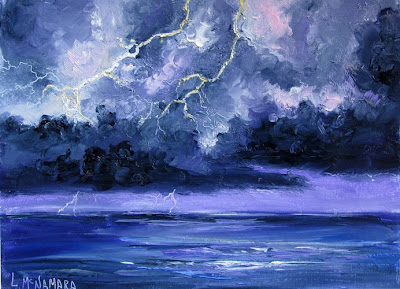
You are a GUI agent. You are given a task and a screenshot of the screen. Output one action in this format:
    pyautogui.click(x=<x>, y=<y>)
    Task: Click on the art
    The image size is (400, 289).
    Given the screenshot: What is the action you would take?
    pyautogui.click(x=315, y=219)